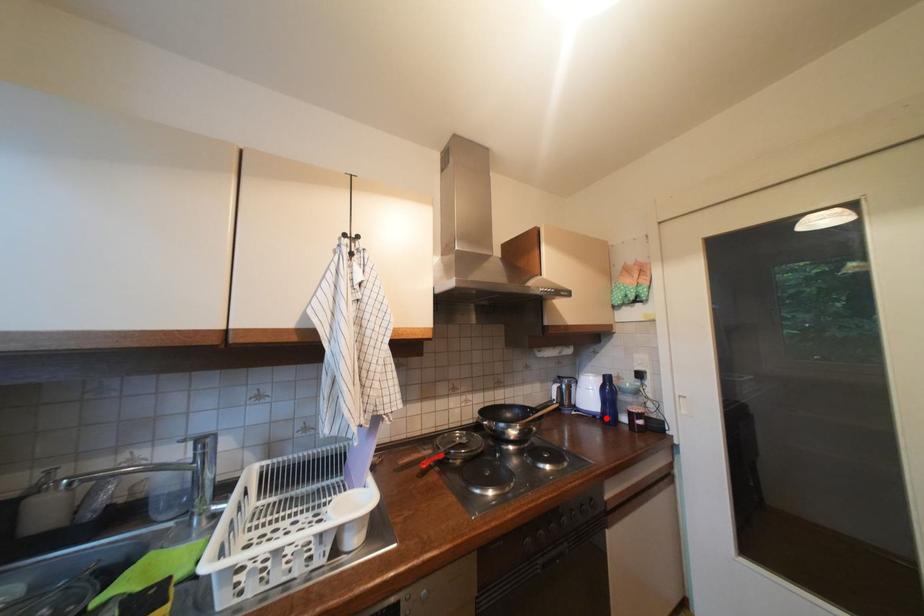
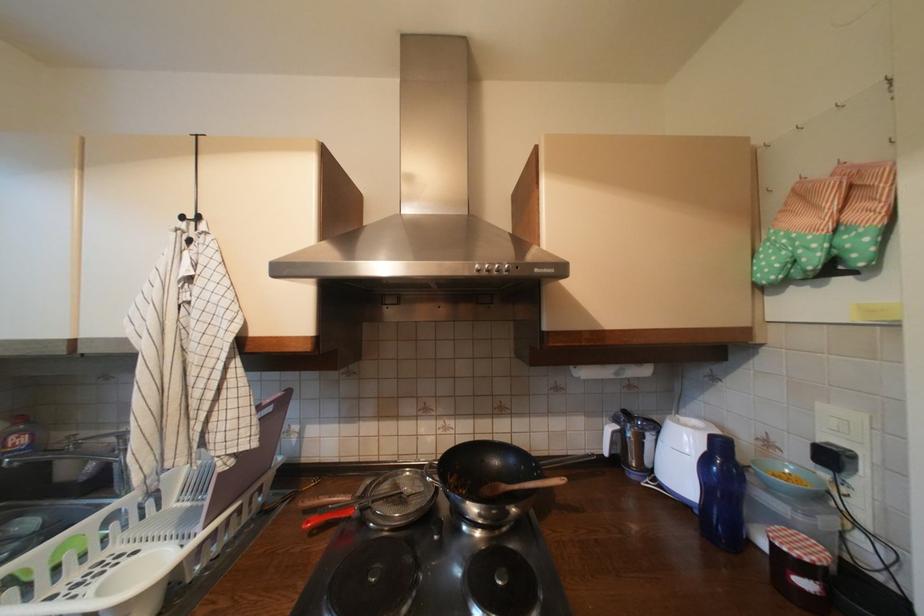
Locate, in the second image, the point that corresponds to the highlighted location in the first image.

(704, 513)